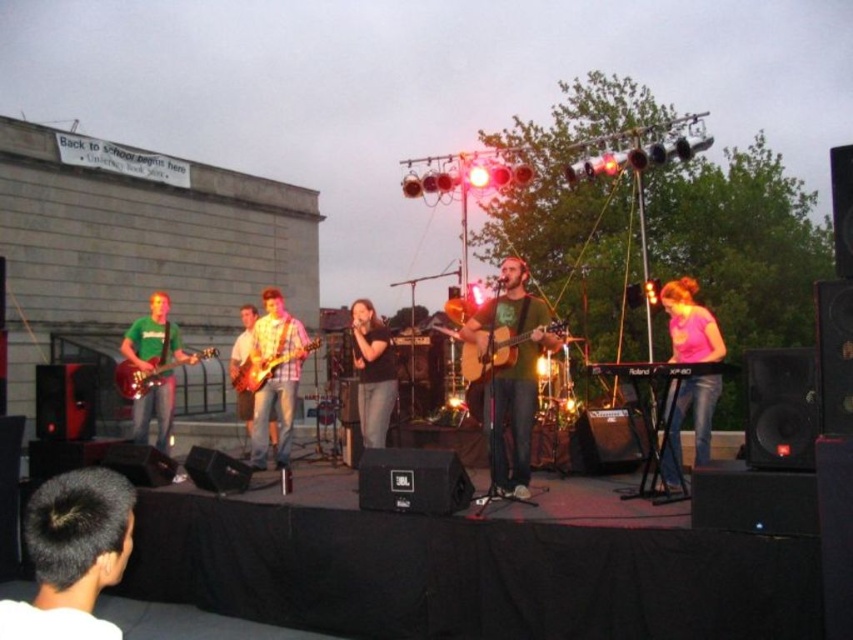
Who is positioned more to the left, black hair at lower left or black matte shirt at center?

From the viewer's perspective, black hair at lower left appears more on the left side.

Who is positioned more to the right, black hair at lower left or black matte shirt at center?

black matte shirt at center

Is point (62, 477) positioned after point (358, 346)?

No, (62, 477) is closer to viewer.

The height and width of the screenshot is (640, 853). I want to click on black hair at lower left, so click(x=73, y=554).

Consider the image. Is plaid shirt at center taller than wooden electric guitar at center?

Yes.

Can you confirm if plaid shirt at center is bigger than wooden electric guitar at center?

Correct, plaid shirt at center is larger in size than wooden electric guitar at center.

Identify the location of plaid shirt at center. The height and width of the screenshot is (640, 853). (276, 376).

This screenshot has height=640, width=853. Identify the location of plaid shirt at center. (276, 376).

Which is behind, point (166, 374) or point (476, 352)?

Point (166, 374)

Measure the distance between green matte guitar at left and matte wood guitar at center.

The distance of green matte guitar at left from matte wood guitar at center is 4.09 meters.

You are a GUI agent. You are given a task and a screenshot of the screen. Output one action in this format:
    pyautogui.click(x=<x>, y=<y>)
    Task: Click on the green matte guitar at left
    The width and height of the screenshot is (853, 640).
    Given the screenshot: What is the action you would take?
    pyautogui.click(x=154, y=339)